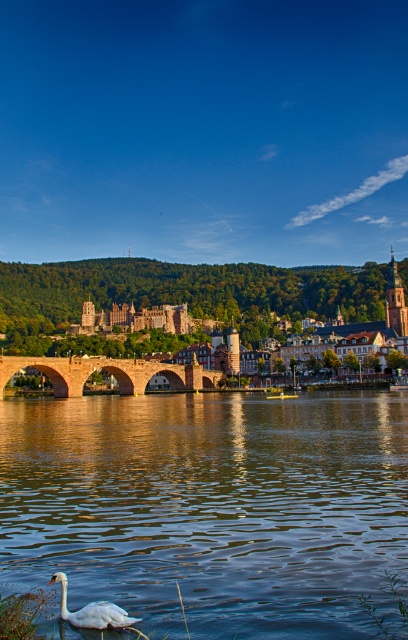
Question: Can you confirm if clear water at river center is positioned above white glossy swan at lower left?

Choices:
 (A) yes
 (B) no

Answer: (B)

Question: Can you confirm if stone arch bridge at center is smaller than white glossy swan at lower left?

Choices:
 (A) no
 (B) yes

Answer: (A)

Question: Which object is the closest to the white glossy swan at lower left?

Choices:
 (A) stone arch bridge at center
 (B) brown stone bridge at center

Answer: (A)

Question: Which is nearer to the white glossy swan at lower left?

Choices:
 (A) brown stone bridge at center
 (B) clear water at river center

Answer: (B)

Question: Estimate the real-world distances between objects in this image. Which object is farther from the white glossy swan at lower left?

Choices:
 (A) stone arch bridge at center
 (B) brown stone bridge at center

Answer: (B)

Question: Can you confirm if clear water at river center is thinner than stone arch bridge at center?

Choices:
 (A) no
 (B) yes

Answer: (A)